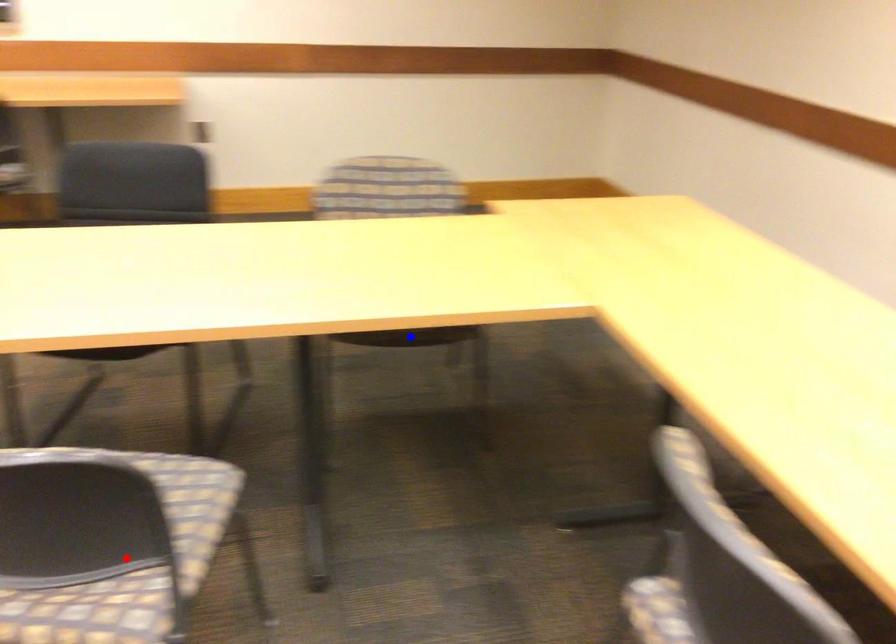
Question: In the image, two points are highlighted. Which point is nearer to the camera? Reply with the corresponding letter.

Choices:
 (A) blue point
 (B) red point

Answer: (B)